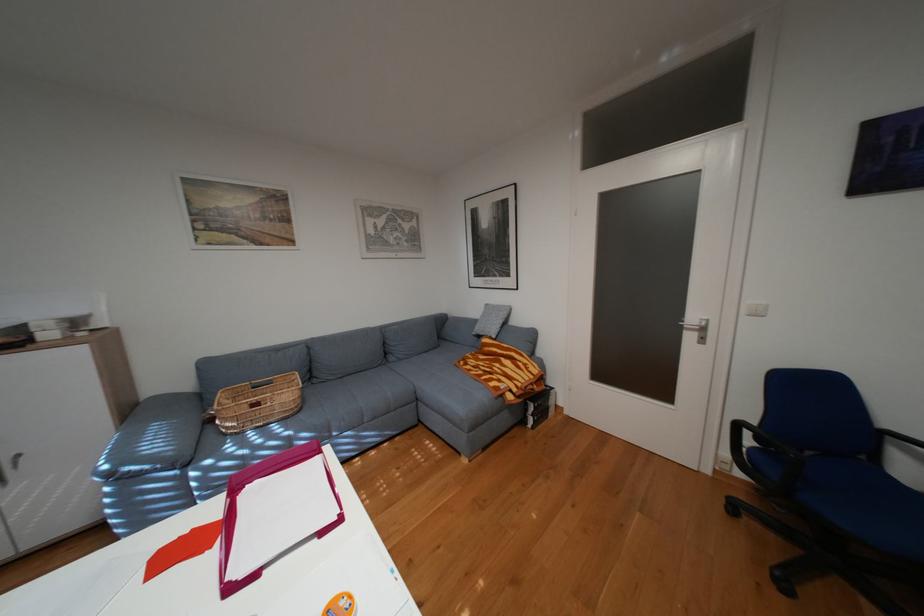
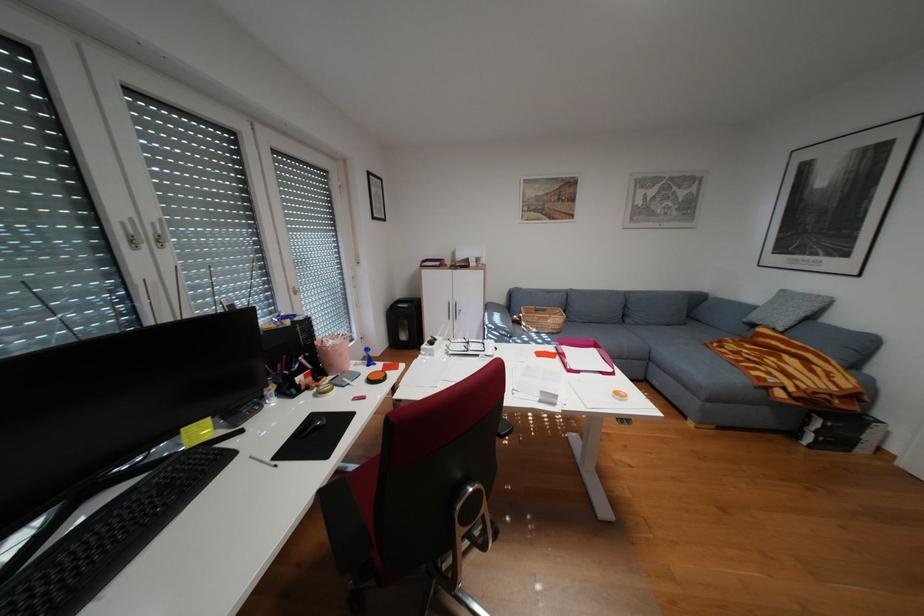
In the second image, find the point that corresponds to point (283, 382) in the first image.

(556, 310)